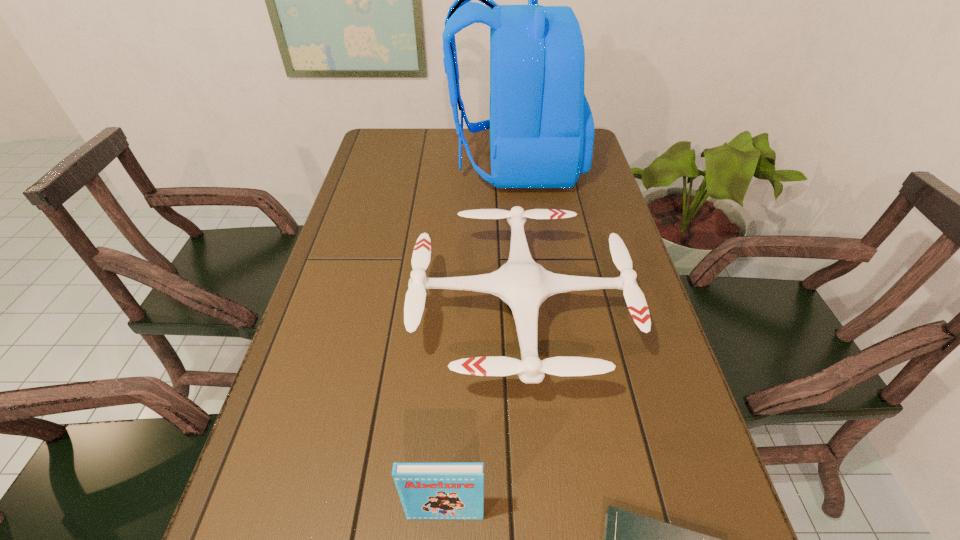
Where is `vacant space located 0.070m with the camera attached at the bottom of the drone`? vacant space located 0.070m with the camera attached at the bottom of the drone is located at coordinates (384, 312).

At what (x,y) coordinates should I click in order to perform the action: click on free spot located 0.050m with the camera attached at the bottom of the drone. Please return your answer as a coordinate pair (x, y). Image resolution: width=960 pixels, height=540 pixels. Looking at the image, I should click on (393, 312).

I want to click on object present at the far edge, so click(541, 126).

The height and width of the screenshot is (540, 960). Find the location of `backpack that is at the right edge`. backpack that is at the right edge is located at coordinates (541, 126).

Where is `drone that is at the right edge`? Image resolution: width=960 pixels, height=540 pixels. drone that is at the right edge is located at coordinates (521, 283).

This screenshot has width=960, height=540. I want to click on object that is at the far right corner, so click(541, 126).

Find the location of a particular element. vacant space at the far edge is located at coordinates (483, 139).

Find the location of a particular element. This screenshot has height=540, width=960. vacant space at the left edge is located at coordinates (394, 206).

In the image, there is a desktop. Identify the location of vacant space at the right edge. This screenshot has width=960, height=540. (564, 223).

Where is `free space that is in between the third nearest object and the third shortest object`? The height and width of the screenshot is (540, 960). free space that is in between the third nearest object and the third shortest object is located at coordinates (483, 413).